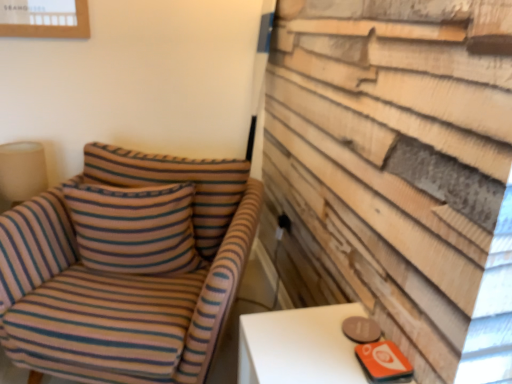
You are a GUI agent. You are given a task and a screenshot of the screen. Output one action in this format:
    pyautogui.click(x=<x>, y=<y>)
    Task: Click on the striped fabric pillow at center
    The height and width of the screenshot is (384, 512).
    Given the screenshot: What is the action you would take?
    pyautogui.click(x=134, y=227)

Describe the element at coordinates (134, 227) in the screenshot. I see `striped fabric pillow at center` at that location.

Image resolution: width=512 pixels, height=384 pixels. Describe the element at coordinates (126, 267) in the screenshot. I see `striped fabric chair at left` at that location.

Find the location of a particular element. striped fabric pillow at center is located at coordinates (134, 227).

From the image's perspective, which one is positioned higher, beige fabric lampshade at left or striped fabric chair at left?

beige fabric lampshade at left, from the image's perspective.

Who is more distant, beige fabric lampshade at left or striped fabric chair at left?

Positioned behind is beige fabric lampshade at left.

Based on the photo, which of these two, beige fabric lampshade at left or striped fabric chair at left, stands shorter?

With less height is beige fabric lampshade at left.

Is beige fabric lampshade at left bigger than striped fabric chair at left?

No, beige fabric lampshade at left is not bigger than striped fabric chair at left.

From a real-world perspective, which object stands above the other?

beige fabric lampshade at left is physically above.

From the picture: From the image's perspective, does striped fabric pillow at center appear lower than beige fabric lampshade at left?

Indeed, from the image's perspective, striped fabric pillow at center is shown beneath beige fabric lampshade at left.

Looking at this image, is the surface of striped fabric pillow at center in direct contact with beige fabric lampshade at left?

No, striped fabric pillow at center is not with beige fabric lampshade at left.

Is beige fabric lampshade at left closer to the viewer compared to black plastic outlet at center-right?

Yes.

Is beige fabric lampshade at left turned away from black plastic outlet at center-right?

No, beige fabric lampshade at left is not facing away from black plastic outlet at center-right.

From the picture: Is beige fabric lampshade at left touching black plastic outlet at center-right?

No, beige fabric lampshade at left is not with black plastic outlet at center-right.

Is striped fabric chair at left bigger than beige fabric lampshade at left?

Indeed, striped fabric chair at left has a larger size compared to beige fabric lampshade at left.

Where is `chair lying below the beige fabric lampshade at left (from the image's perspective)`? chair lying below the beige fabric lampshade at left (from the image's perspective) is located at coordinates (126, 267).

In terms of height, does striped fabric chair at left look taller or shorter compared to beige fabric lampshade at left?

Considering their sizes, striped fabric chair at left has more height than beige fabric lampshade at left.

From a real-world perspective, does striped fabric chair at left stand above beige fabric lampshade at left?

No, from a real-world perspective, striped fabric chair at left is not above beige fabric lampshade at left.

In the scene shown: Is striped fabric pillow at center looking in the opposite direction of striped fabric chair at left?

Yes, striped fabric pillow at center is positioned with its back facing striped fabric chair at left.

Is striped fabric pillow at center positioned far away from striped fabric chair at left?

No, striped fabric pillow at center is not far from striped fabric chair at left.

Which of these two, striped fabric pillow at center or striped fabric chair at left, is thinner?

Thinner between the two is striped fabric pillow at center.

From a real-world perspective, is striped fabric pillow at center physically below striped fabric chair at left?

Actually, striped fabric pillow at center is physically above striped fabric chair at left in the real world.

Considering the relative positions of striped fabric chair at left and striped fabric pillow at center in the image provided, is striped fabric chair at left to the left or to the right of striped fabric pillow at center?

From the image, it's evident that striped fabric chair at left is to the right of striped fabric pillow at center.

Is striped fabric chair at left positioned behind striped fabric pillow at center?

No, striped fabric chair at left is closer to the camera.

What's the angular difference between striped fabric chair at left and striped fabric pillow at center's facing directions?

The angular difference between striped fabric chair at left and striped fabric pillow at center is 13.8 degrees.

In the scene shown: Is striped fabric chair at left directly adjacent to striped fabric pillow at center?

No, striped fabric chair at left is not touching striped fabric pillow at center.

Is black plastic outlet at center-right outside of striped fabric pillow at center?

That's correct, black plastic outlet at center-right is outside of striped fabric pillow at center.

Looking at this image, relative to striped fabric pillow at center, is black plastic outlet at center-right in front or behind?

black plastic outlet at center-right is behind striped fabric pillow at center.

Which is farther from the camera, (x=280, y=222) or (x=111, y=267)?

The point (x=280, y=222) is farther from the camera.

Looking at this image, looking at their sizes, would you say black plastic outlet at center-right is wider or thinner than striped fabric pillow at center?

In the image, black plastic outlet at center-right appears to be more narrow than striped fabric pillow at center.

Where is `chair below the beige fabric lampshade at left (from a real-world perspective)`? This screenshot has height=384, width=512. chair below the beige fabric lampshade at left (from a real-world perspective) is located at coordinates (126, 267).

Identify the location of pillow that is below the beige fabric lampshade at left (from the image's perspective). The height and width of the screenshot is (384, 512). (134, 227).

From the image, which object appears to be farther from black plastic outlet at center-right, beige fabric lampshade at left or striped fabric chair at left?

beige fabric lampshade at left is further to black plastic outlet at center-right.

When comparing their distances from beige fabric lampshade at left, does striped fabric chair at left or striped fabric pillow at center seem closer?

striped fabric pillow at center is positioned closer to the anchor beige fabric lampshade at left.

Based on the photo, when comparing their distances from beige fabric lampshade at left, does black plastic outlet at center-right or striped fabric chair at left seem closer?

The object closer to beige fabric lampshade at left is striped fabric chair at left.

From the image, which object appears to be nearer to striped fabric pillow at center, black plastic outlet at center-right or striped fabric chair at left?

Among the two, striped fabric chair at left is located nearer to striped fabric pillow at center.

When comparing their distances from black plastic outlet at center-right, does striped fabric chair at left or striped fabric pillow at center seem closer?

striped fabric pillow at center.

When comparing their distances from striped fabric chair at left, does black plastic outlet at center-right or beige fabric lampshade at left seem further?

Based on the image, black plastic outlet at center-right appears to be further to striped fabric chair at left.

Based on their spatial positions, is striped fabric chair at left or black plastic outlet at center-right closer to beige fabric lampshade at left?

Based on the image, striped fabric chair at left appears to be nearer to beige fabric lampshade at left.

Based on their spatial positions, is black plastic outlet at center-right or striped fabric pillow at center further from striped fabric chair at left?

black plastic outlet at center-right lies further to striped fabric chair at left than the other object.

The image size is (512, 384). What are the coordinates of `chair between beige fabric lampshade at left and black plastic outlet at center-right in the horizontal direction` in the screenshot? It's located at (126, 267).

At what (x,y) coordinates should I click in order to perform the action: click on pillow between beige fabric lampshade at left and black plastic outlet at center-right. Please return your answer as a coordinate pair (x, y). Looking at the image, I should click on (134, 227).

Identify the location of pillow positioned between striped fabric chair at left and black plastic outlet at center-right from near to far. (134, 227).

You are a GUI agent. You are given a task and a screenshot of the screen. Output one action in this format:
    pyautogui.click(x=<x>, y=<y>)
    Task: Click on the pillow between striped fabric chair at left and beige fabric lampshade at left in the front-back direction
    The image size is (512, 384).
    Given the screenshot: What is the action you would take?
    pyautogui.click(x=134, y=227)